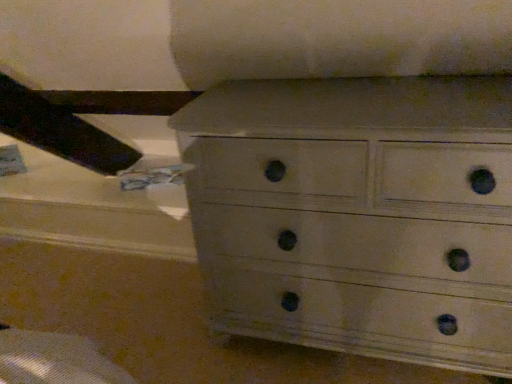
Identify the location of free location above white painted wood chest of drawers at center (from a real-world perspective). The height and width of the screenshot is (384, 512). (364, 100).